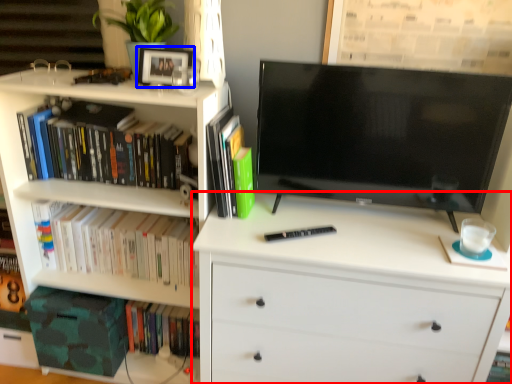
Question: Which point is closer to the camera, chest of drawers (highlighted by a red box) or picture frame (highlighted by a blue box)?

Choices:
 (A) chest of drawers
 (B) picture frame

Answer: (A)